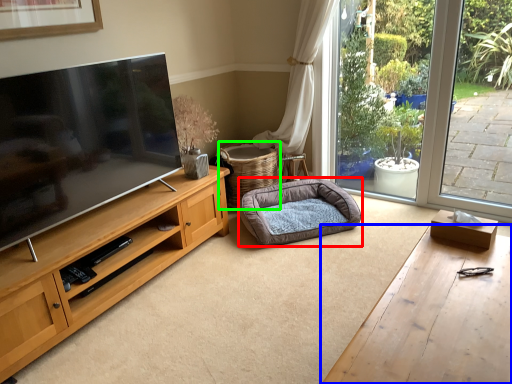
Question: Which object is the closest to the dog bed (highlighted by a red box)? Choose among these: desk (highlighted by a blue box) or basket (highlighted by a green box).

Choices:
 (A) desk
 (B) basket

Answer: (B)